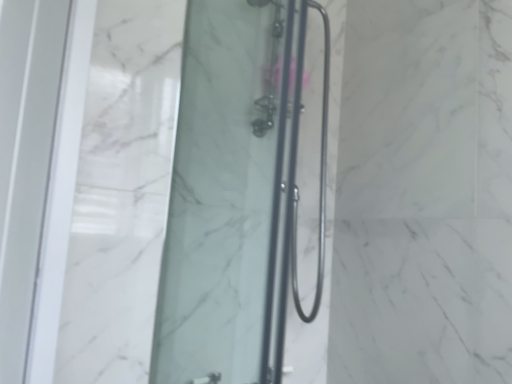
Question: Based on their sizes in the image, would you say black metal shower door at center, the first shower door when ordered from back to front, is bigger or smaller than transparent glass shower door at center, the first shower door viewed from the front?

Choices:
 (A) small
 (B) big

Answer: (A)

Question: In the image, is black metal shower door at center, the 1th shower door when ordered from right to left, on the left side or the right side of transparent glass shower door at center, which appears as the 2th shower door when viewed from the right?

Choices:
 (A) left
 (B) right

Answer: (B)

Question: Considering the positions of point (291, 244) and point (286, 110), is point (291, 244) closer or farther from the camera than point (286, 110)?

Choices:
 (A) farther
 (B) closer

Answer: (A)

Question: From the image's perspective, is transparent glass shower door at center, which appears as the 2th shower door when viewed from the right, above or below black metal shower door at center, the 2th shower door positioned from the left?

Choices:
 (A) above
 (B) below

Answer: (B)

Question: Looking at their shapes, would you say transparent glass shower door at center, positioned as the second shower door in back-to-front order, is wider or thinner than black metal shower door at center, the 1th shower door when ordered from right to left?

Choices:
 (A) wide
 (B) thin

Answer: (B)

Question: Is transparent glass shower door at center, which appears as the 2th shower door when viewed from the right, spatially inside black metal shower door at center, the 2th shower door positioned from the left, or outside of it?

Choices:
 (A) outside
 (B) inside

Answer: (A)

Question: From a real-world perspective, is transparent glass shower door at center, the first shower door viewed from the front, positioned above or below black metal shower door at center, the 2th shower door when ordered from front to back?

Choices:
 (A) above
 (B) below

Answer: (B)